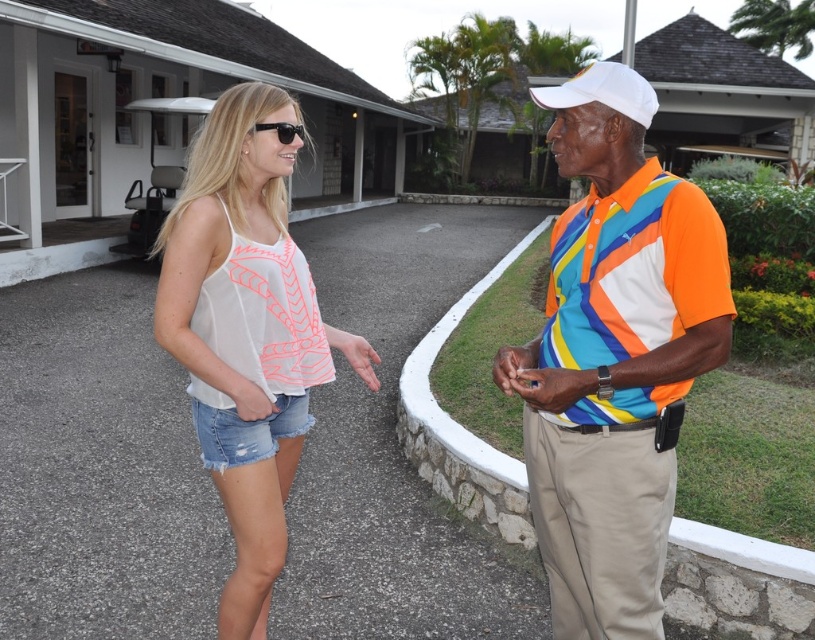
How far apart are multicolored jersey at center and white sheer tank top at center?

32.98 inches

Is multicolored jersey at center to the right of white sheer tank top at center from the viewer's perspective?

Yes, multicolored jersey at center is to the right of white sheer tank top at center.

Locate an element on the screen. The image size is (815, 640). multicolored jersey at center is located at coordinates (613, 356).

Is multicolored jersey at center taller than denim shorts at center?

Yes.

Locate an element on the screen. multicolored jersey at center is located at coordinates (613, 356).

From the picture: Is denim shorts at center behind black plastic sunglasses at upper center?

No, denim shorts at center is closer to the viewer.

Between denim shorts at center and black plastic sunglasses at upper center, which one has less height?

With less height is denim shorts at center.

Locate an element on the screen. denim shorts at center is located at coordinates tap(247, 432).